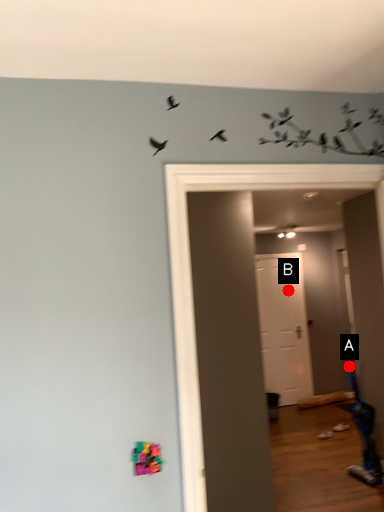
Question: Two points are circled on the image, labeled by A and B beside each circle. Which of the following is the farthest from the observer?

Choices:
 (A) A is further
 (B) B is further

Answer: (B)